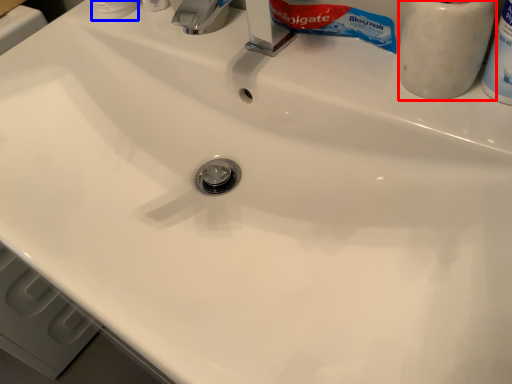
Question: Which object is further to the camera taking this photo, toiletry (highlighted by a red box) or toiletry (highlighted by a blue box)?

Choices:
 (A) toiletry
 (B) toiletry

Answer: (B)